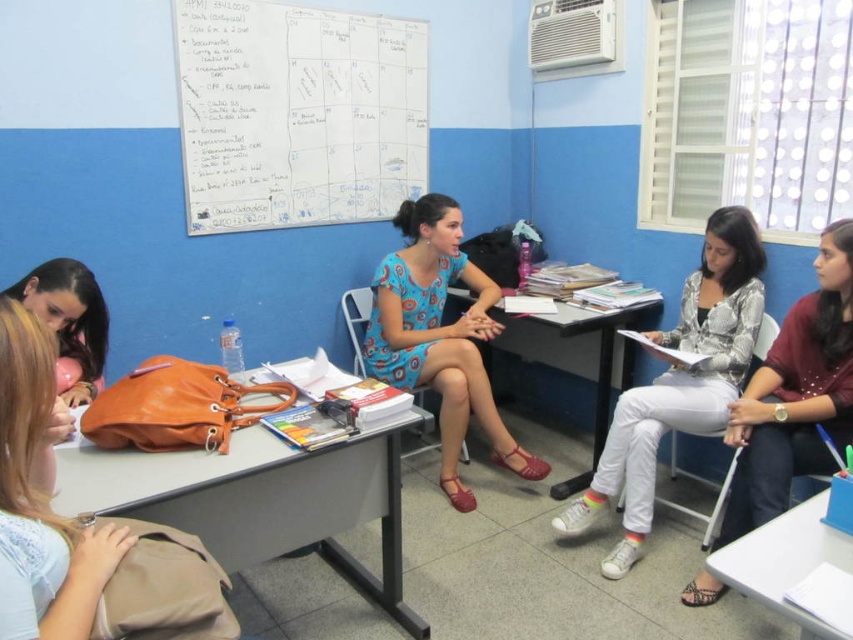
Question: Can you confirm if matte beige backpack at lower left is positioned to the right of white textured blouse at right?

Choices:
 (A) no
 (B) yes

Answer: (A)

Question: Estimate the real-world distances between objects in this image. Which object is farther from the matte brown table at center?

Choices:
 (A) matte floral dress at center
 (B) white matte pants at center
 (C) whiteboard at upper center
 (D) wooden table at center

Answer: (C)

Question: Is white matte pants at center to the right of matte black hair at lower left from the viewer's perspective?

Choices:
 (A) yes
 (B) no

Answer: (A)

Question: Does matte brown table at center come behind white textured blouse at right?

Choices:
 (A) no
 (B) yes

Answer: (A)

Question: Which of these objects is positioned farthest from the whiteboard at upper center?

Choices:
 (A) white textured blouse at right
 (B) matte black hair at lower left
 (C) matte beige backpack at lower left

Answer: (C)

Question: Which object is closer to the camera taking this photo?

Choices:
 (A) matte floral dress at center
 (B) wooden table at center
 (C) whiteboard at upper center
 (D) blue plastic table at lower right

Answer: (D)